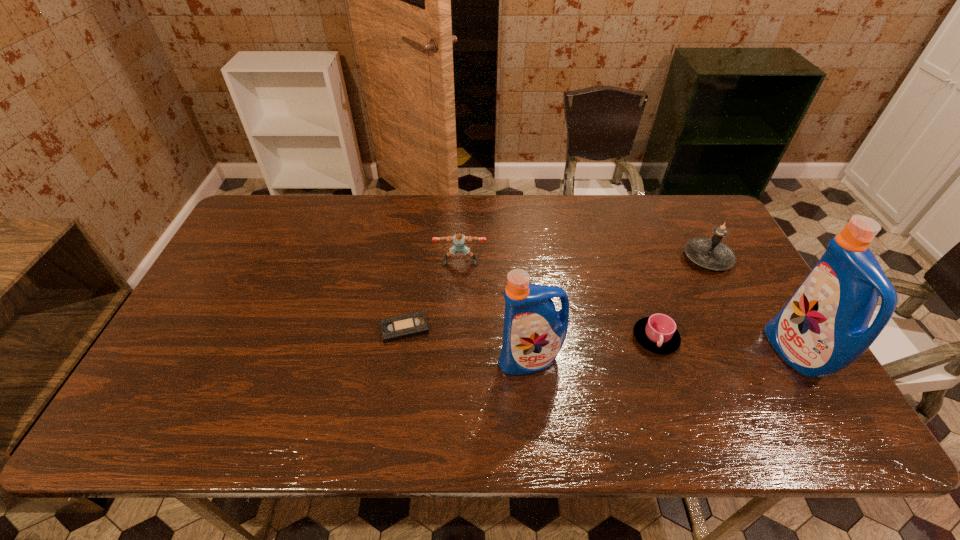
Image resolution: width=960 pixels, height=540 pixels. Identify the location of blank space at the near edge. (581, 392).

The height and width of the screenshot is (540, 960). In order to click on free space at the left edge in this screenshot , I will do `click(242, 292)`.

Locate an element on the screen. The height and width of the screenshot is (540, 960). vacant space at the right edge is located at coordinates (757, 330).

At what (x,y) coordinates should I click in order to perform the action: click on vacant region at the far left corner. Please return your answer as a coordinate pair (x, y). This screenshot has width=960, height=540. Looking at the image, I should click on (288, 214).

Where is `vacant space at the near left corner`? vacant space at the near left corner is located at coordinates (219, 367).

Find the location of `vacant space at the far right corner of the desktop`. vacant space at the far right corner of the desktop is located at coordinates (670, 195).

Locate an element on the screen. This screenshot has height=540, width=960. empty space between the fourth tallest object and the videotape is located at coordinates (433, 295).

This screenshot has width=960, height=540. In order to click on vacant point located between the fourth tallest object and the third object from left to right in this screenshot , I will do `click(495, 311)`.

This screenshot has width=960, height=540. Find the location of `free point between the taller detergent and the videotape`. free point between the taller detergent and the videotape is located at coordinates (600, 341).

What are the coordinates of `vacant space that is in between the shortest object and the third object from left to right` in the screenshot? It's located at (468, 345).